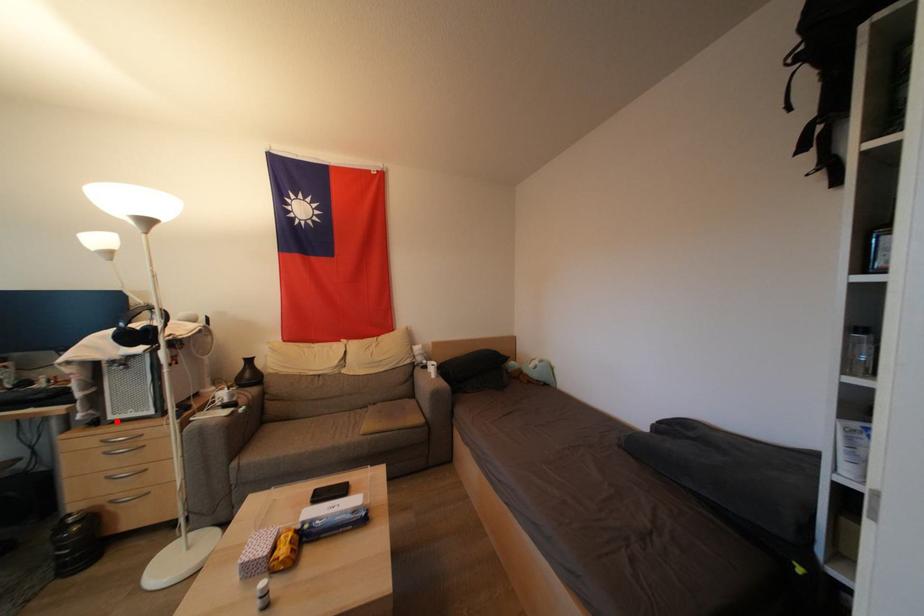
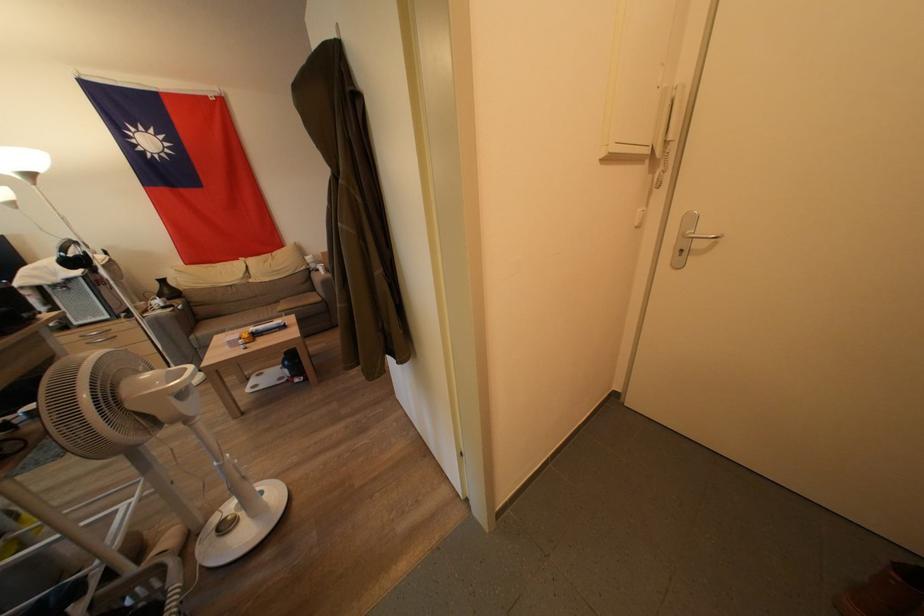
Question: I am providing you with two images of the same scene from different viewpoints. A red point is shown in image1. For the corresponding object point in image2, is it positioned nearer or farther from the camera?

Choices:
 (A) Nearer
 (B) Farther

Answer: (B)